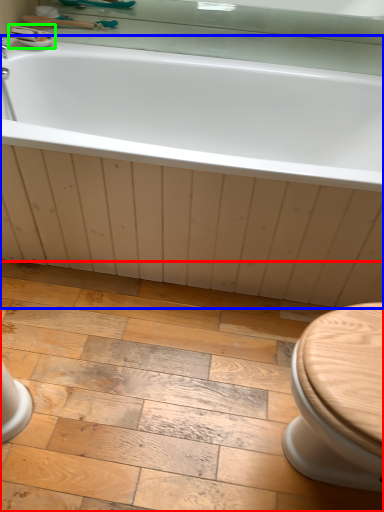
Question: Which object is the closest to the ceramic tile (highlighted by a red box)? Choose among these: bathtub (highlighted by a blue box) or sink (highlighted by a green box).

Choices:
 (A) bathtub
 (B) sink

Answer: (A)